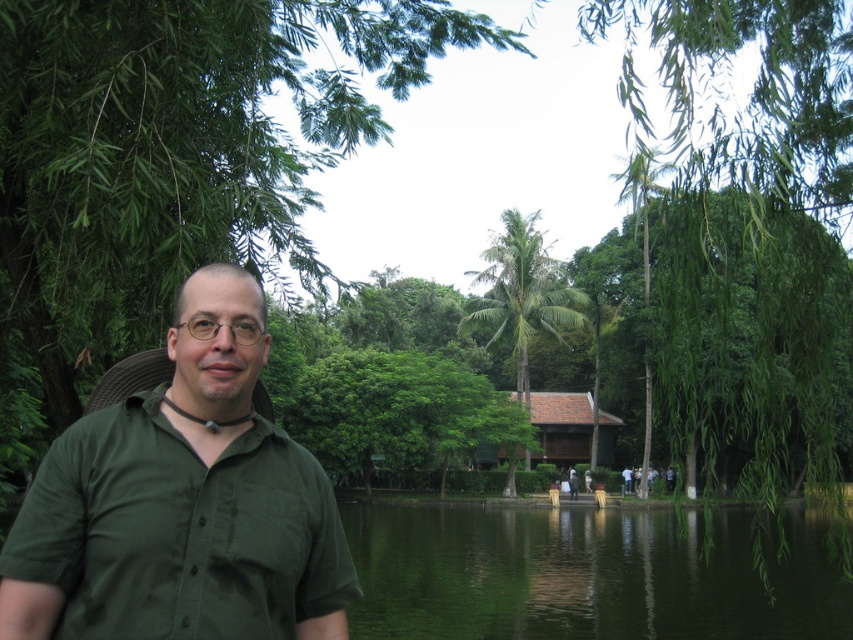
Question: Which of the following is the closest to the observer?

Choices:
 (A) green reflective water at center
 (B) green matte shirt at center
 (C) green leafy palm tree at center
 (D) green leafy tree at upper left

Answer: (B)

Question: Which is farther from the green matte shirt at center?

Choices:
 (A) green reflective water at center
 (B) green leafy tree at upper left

Answer: (A)

Question: Observing the image, what is the correct spatial positioning of green leafy tree at upper left in reference to green reflective water at center?

Choices:
 (A) right
 (B) left

Answer: (B)

Question: Does green matte shirt at center appear on the right side of green leafy palm tree at center?

Choices:
 (A) no
 (B) yes

Answer: (A)

Question: Which object appears closest to the camera in this image?

Choices:
 (A) green leafy tree at upper left
 (B) green matte shirt at center
 (C) green leafy palm tree at center
 (D) green reflective water at center

Answer: (B)

Question: Does green leafy tree at upper left appear on the right side of green reflective water at center?

Choices:
 (A) yes
 (B) no

Answer: (B)